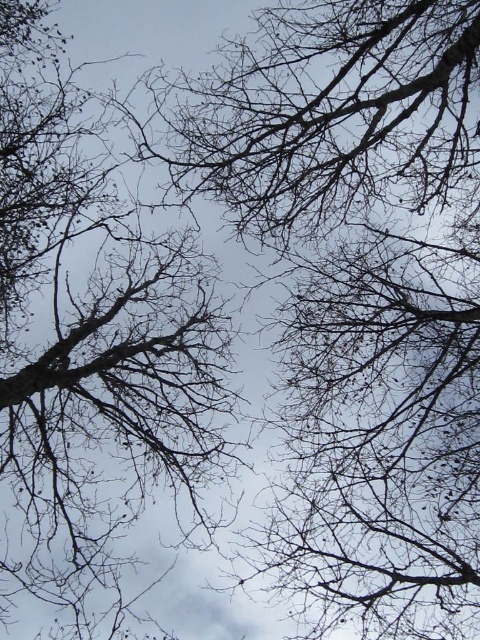
You are a bird trying to fly through the canopy. The distance between the bare branches at center and the dark brown branches at upper center is crucial for your flight path. Can you safely navigate between them if your wingspan is 1.5 meters?

The distance between the bare branches at center and the dark brown branches at upper center is 4.49 meters. Since your wingspan is 1.5 meters, which is significantly smaller than the gap, you can safely navigate between them.

You are a bird trying to land on a branch. You see the bare branches at center and the dark brown branches at upper center. Which branch group is closer to the sky?

The dark brown branches at upper center are closer to the sky since they are positioned above the bare branches at center.